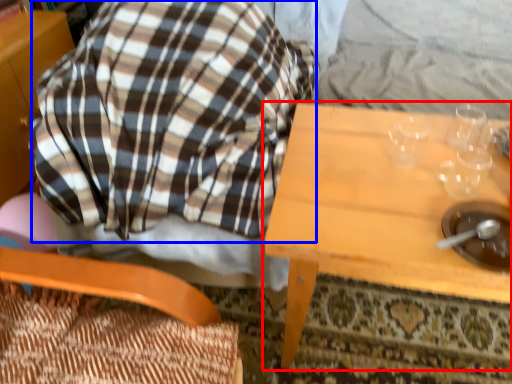
Question: Which of the following is the closest to the observer, table (highlighted by a red box) or flannel (highlighted by a blue box)?

Choices:
 (A) table
 (B) flannel

Answer: (B)